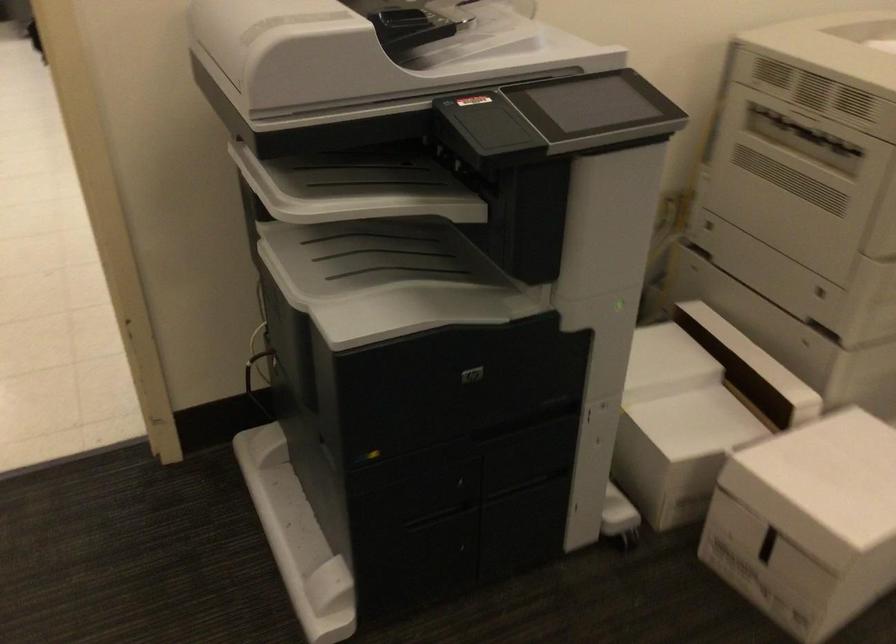
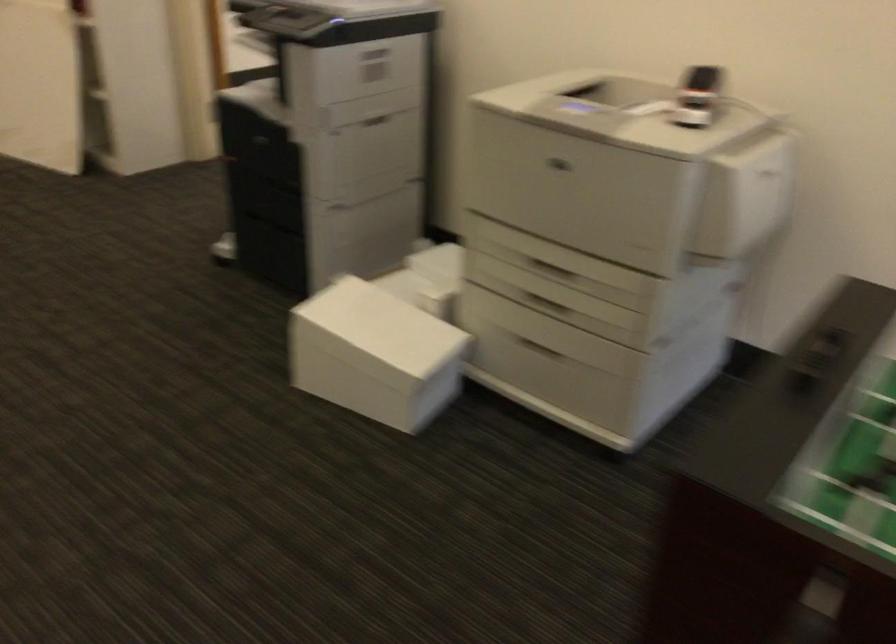
Question: I am providing you with two images of the same scene from different viewpoints. Please identify which objects are invisible in image2.

Choices:
 (A) black phone
 (B) brown tape dispenser
 (C) printer output tray
 (D) printer drawer handle

Answer: (C)